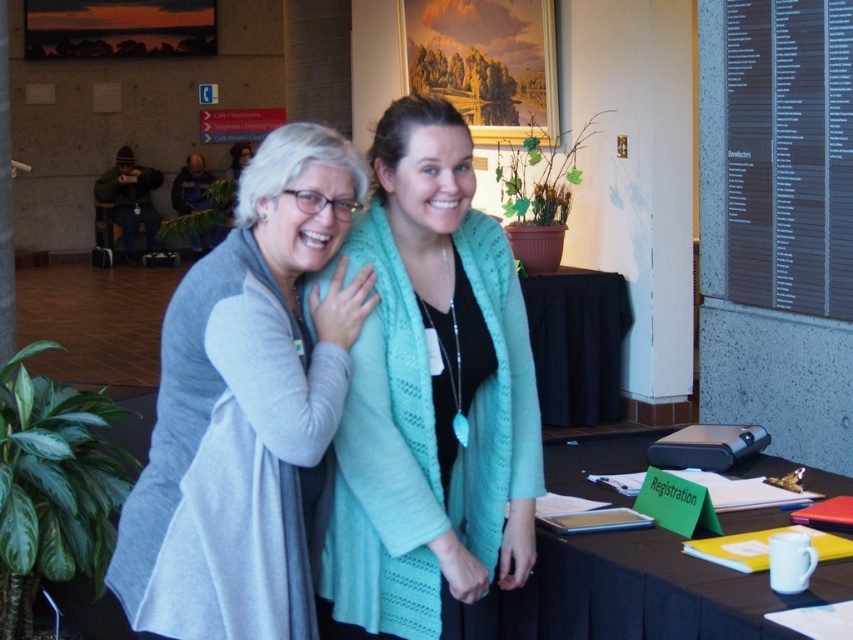
Question: Can you confirm if gray soft sweater at center is positioned to the right of black fabric table at center?

Choices:
 (A) no
 (B) yes

Answer: (A)

Question: Does teal knitted cardigan at center have a smaller size compared to gray soft sweater at center?

Choices:
 (A) no
 (B) yes

Answer: (A)

Question: Can you confirm if gray soft sweater at center is positioned to the left of black fabric table at center?

Choices:
 (A) yes
 (B) no

Answer: (A)

Question: Which object is positioned farthest from the black fabric table at center?

Choices:
 (A) gray soft sweater at center
 (B) teal knitted cardigan at center

Answer: (A)

Question: Which object is positioned farthest from the teal knitted cardigan at center?

Choices:
 (A) gray soft sweater at center
 (B) black fabric table at center

Answer: (B)

Question: Which point is farther from the camera taking this photo?

Choices:
 (A) (405, 97)
 (B) (535, 312)
 (C) (265, 468)

Answer: (B)